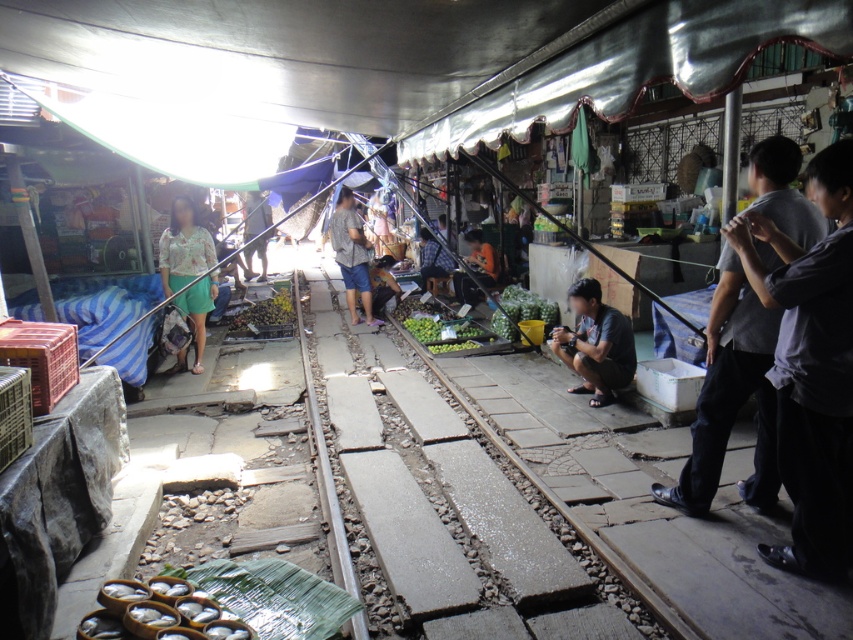
You are a customer at the market and want to buy the dark gray shirt at center. However, you notice another matte gray shirt at center nearby. Which shirt is closer to the ground?

The dark gray shirt at center is closer to the ground because it is located below the matte gray shirt at center.

You are a customer at the market and want to buy a shirt. You see two shirts available for sale. The dark gray shirt at right and the matte gray shirt at center. Which shirt is narrower?

The dark gray shirt at right is narrower than the matte gray shirt at center.